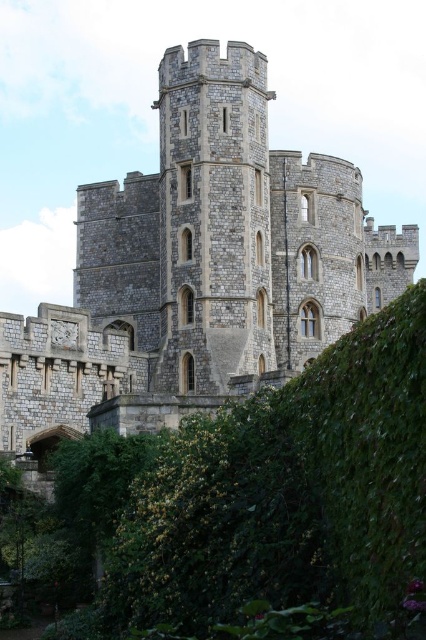
Is point (288, 211) positioned behind point (219, 145)?

Yes, point (288, 211) is behind point (219, 145).

Where is `stone tower at center`? stone tower at center is located at coordinates (198, 269).

The height and width of the screenshot is (640, 426). In order to click on stone tower at center in this screenshot , I will do `click(198, 269)`.

Consider the image. How much distance is there between green leafy hedge at lower left and stone medieval tower at center?

A distance of 21.51 meters exists between green leafy hedge at lower left and stone medieval tower at center.

Is point (241, 513) closer to camera compared to point (158, 378)?

Yes.

Is point (290, 636) positioned in front of point (250, 314)?

Yes, it is in front of point (250, 314).

This screenshot has width=426, height=640. I want to click on green leafy hedge at lower left, so click(x=256, y=502).

Does stone tower at center have a smaller size compared to green leafy hedge at lower left?

No.

Does stone tower at center have a lesser height compared to green leafy hedge at lower left?

No.

In order to click on stone tower at center in this screenshot , I will do click(x=198, y=269).

At what (x,y) coordinates should I click in order to perform the action: click on stone tower at center. Please return your answer as a coordinate pair (x, y). This screenshot has width=426, height=640. Looking at the image, I should click on (198, 269).